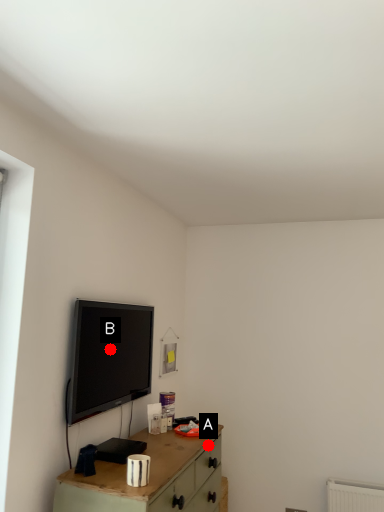
Question: Two points are circled on the image, labeled by A and B beside each circle. Which of the following is the closest to the observer?

Choices:
 (A) A is closer
 (B) B is closer

Answer: (B)